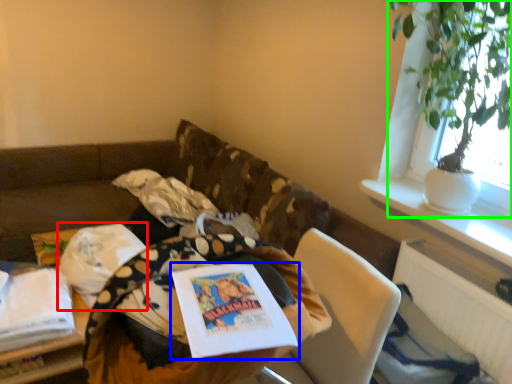
Question: Estimate the real-world distances between objects in this image. Which object is farther from material (highlighted by a red box), book (highlighted by a blue box) or houseplant (highlighted by a green box)?

Choices:
 (A) book
 (B) houseplant

Answer: (B)